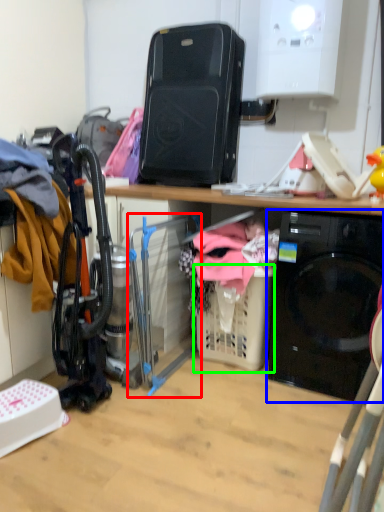
Question: Based on their relative distances, which object is nearer to appliance (highlighted by a red box)? Choose from home appliance (highlighted by a blue box) and basket (highlighted by a green box).

Choices:
 (A) home appliance
 (B) basket

Answer: (B)